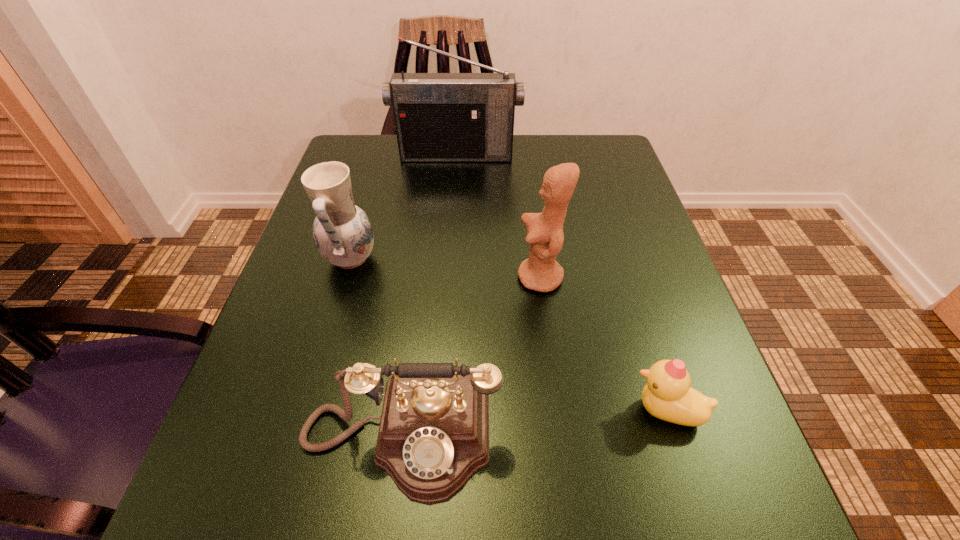
Find the location of a particular element. Image resolution: width=960 pixels, height=540 pixels. free space that is in between the second shortest object and the third tallest object is located at coordinates tap(375, 348).

Find the location of a particular element. Image resolution: width=960 pixels, height=540 pixels. vacant area that lies between the radio receiver and the pottery is located at coordinates (403, 207).

Find the location of a particular element. This screenshot has height=540, width=960. unoccupied position between the figurine and the second shortest object is located at coordinates (470, 357).

Find the location of a particular element. free area in between the duckling and the fourth shortest object is located at coordinates (603, 344).

At what (x,y) coordinates should I click in order to perform the action: click on free space between the radio receiver and the figurine. Please return your answer as a coordinate pair (x, y). The width and height of the screenshot is (960, 540). Looking at the image, I should click on (498, 217).

What are the coordinates of `vacant space that's between the second tallest object and the second shortest object` in the screenshot? It's located at (470, 357).

Where is `free space between the figurine and the pottery`? free space between the figurine and the pottery is located at coordinates (445, 268).

Locate which object is the second closest to the radio receiver. Please provide its 2D coordinates. Your answer should be formatted as a tuple, i.e. [(x, y)], where the tuple contains the x and y coordinates of a point satisfying the conditions above.

[(541, 272)]

This screenshot has height=540, width=960. I want to click on the third closest object to the pottery, so click(439, 117).

Find the location of `vacant space that satisfies the following two spatial constraints: 1. on the front-facing side of the figurine; 2. on the dial of the telephone`. vacant space that satisfies the following two spatial constraints: 1. on the front-facing side of the figurine; 2. on the dial of the telephone is located at coordinates (562, 437).